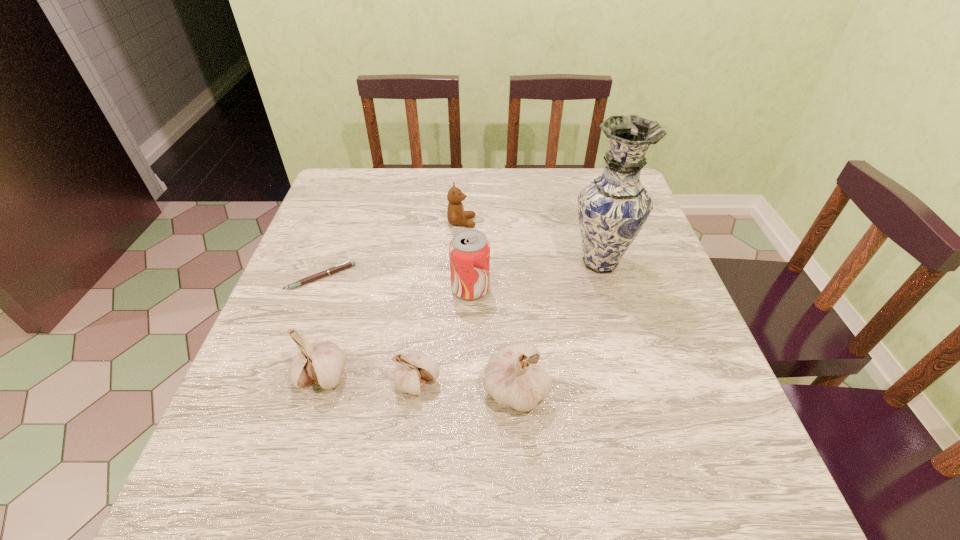
Identify the location of vacant region between the tallest garlic and the vase. Image resolution: width=960 pixels, height=540 pixels. (558, 326).

The width and height of the screenshot is (960, 540). Identify the location of free point between the shortest garlic and the tallest garlic. (467, 386).

Where is `free point between the leftmost garlic and the shortest object`? This screenshot has width=960, height=540. free point between the leftmost garlic and the shortest object is located at coordinates (322, 326).

The width and height of the screenshot is (960, 540). Find the location of `object that is the third nearest to the pen`. object that is the third nearest to the pen is located at coordinates (412, 371).

The image size is (960, 540). Find the location of `the second closest object to the second garlic from right to left`. the second closest object to the second garlic from right to left is located at coordinates (321, 363).

Find the location of `garlic that stands as the second closest to the second garlic from left to right`. garlic that stands as the second closest to the second garlic from left to right is located at coordinates (321, 363).

This screenshot has height=540, width=960. I want to click on garlic that is the nearest to the tallest object, so click(512, 377).

The height and width of the screenshot is (540, 960). Identify the location of vacant region that satisfies the following two spatial constraints: 1. on the back side of the tallest garlic; 2. on the front-facing side of the teddy bear. pos(505,222).

I want to click on vacant position in the image that satisfies the following two spatial constraints: 1. at the nib of the pen; 2. on the right side of the rightmost garlic, so click(279, 389).

What are the coordinates of `vacant space that satisfies the following two spatial constraints: 1. on the front-facing side of the teddy bear; 2. on the back side of the soda can` in the screenshot? It's located at coord(459,288).